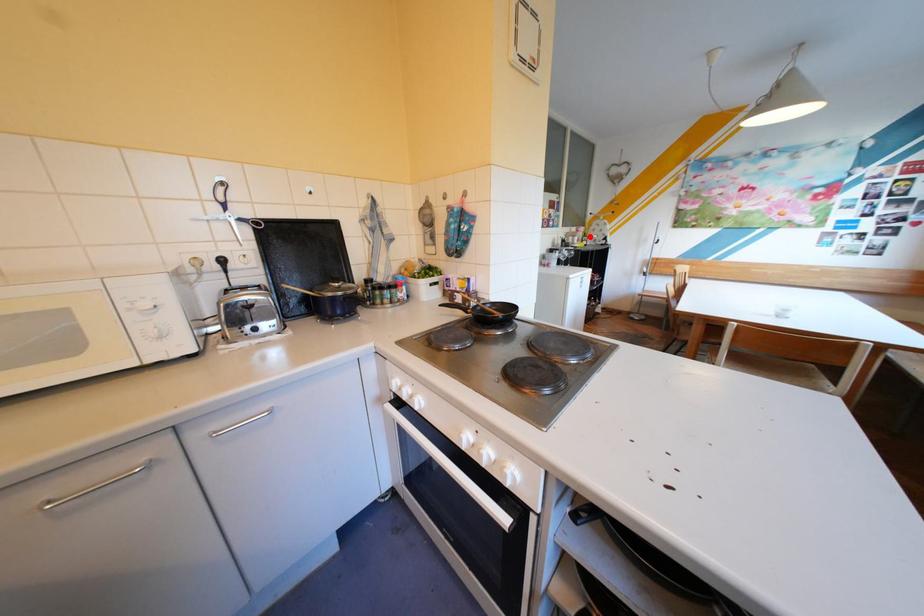
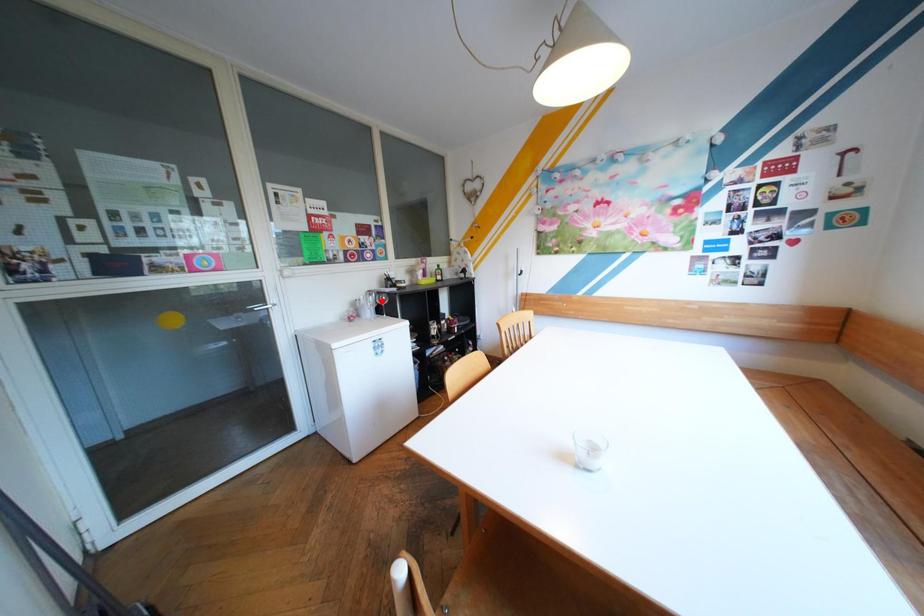
I am providing you with two images of the same scene from different viewpoints. A red point is marked on the first image and another point is marked on the second image. Does the point marked in image1 correspond to the same location as the one in image2?

No